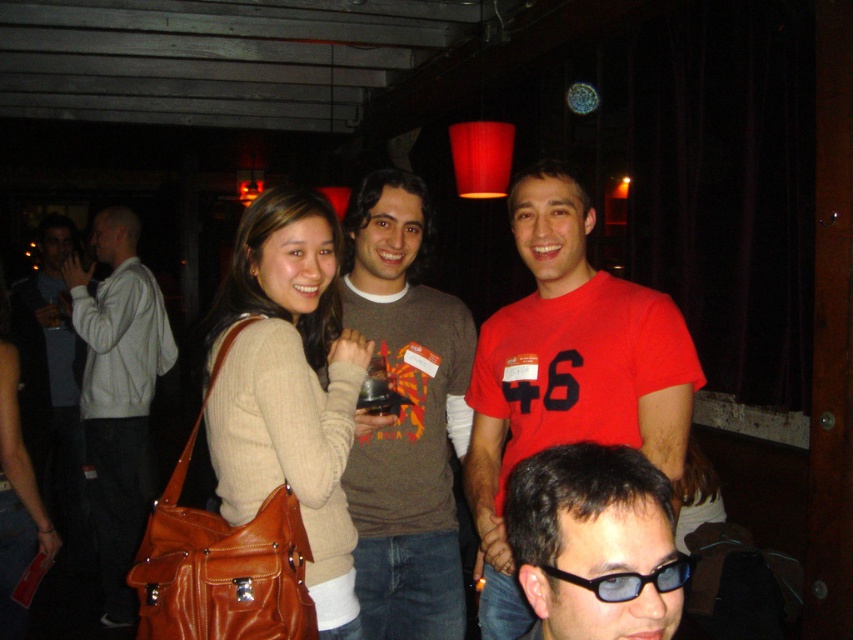
You are taking a photo of the scene and want to focus on two points in the image. The first point is at coordinate point [373,499] and the second is at point [646,605]. Which point should you focus on first if you want to ensure the closest object is in focus?

Result: You should focus on point [373,499] first because it is closer to the camera than point [646,605], ensuring the closest object is in focus.

You are at the center of the image and want to hand a gift to the person wearing the white cotton hoodie at left. In which direction should you move to reach them?

The white cotton hoodie at left is located at point (x=119, y=394), so you should move to the left and slightly downward to reach the person wearing the white cotton hoodie at left.